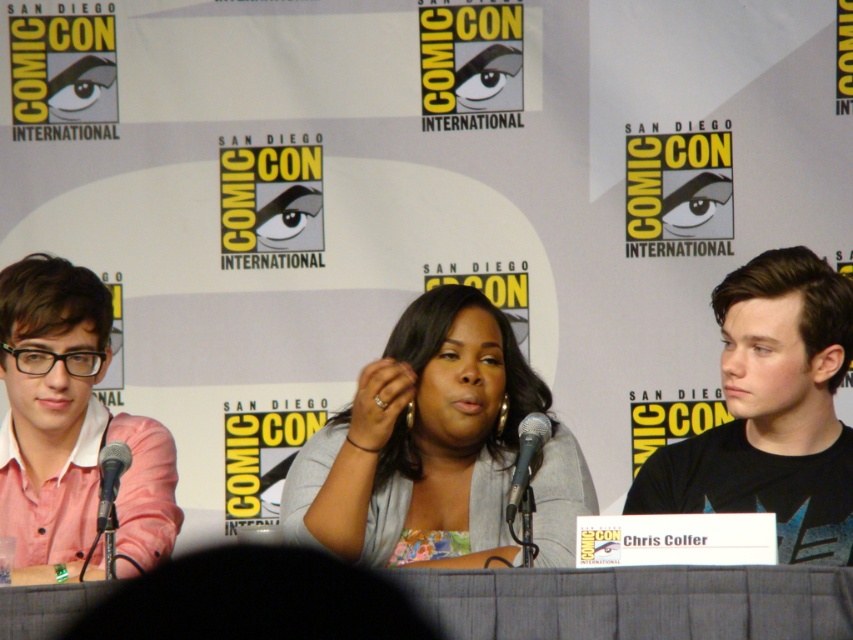
Is gray fabric at center below black metallic microphone at left?

Actually, gray fabric at center is above black metallic microphone at left.

Does point (425, 353) come behind point (102, 488)?

That is True.

This screenshot has height=640, width=853. I want to click on gray fabric at center, so click(x=421, y=444).

Which of these two, gray fabric at center or metallic silver microphone at center, stands shorter?

metallic silver microphone at center is shorter.

Can you confirm if gray fabric at center is positioned above metallic silver microphone at center?

Correct, gray fabric at center is located above metallic silver microphone at center.

This screenshot has height=640, width=853. In order to click on gray fabric at center in this screenshot , I will do `click(421, 444)`.

Describe the element at coordinates (70, 428) in the screenshot. This screenshot has width=853, height=640. I see `pink shirt at left` at that location.

Describe the element at coordinates (70, 428) in the screenshot. I see `pink shirt at left` at that location.

This screenshot has width=853, height=640. In order to click on pink shirt at left in this screenshot , I will do `click(70, 428)`.